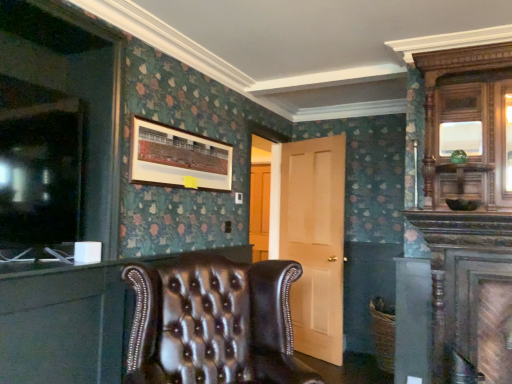
Question: Based on their sizes in the image, would you say matte wooden picture frame at upper center is bigger or smaller than leather tufted chair at lower left?

Choices:
 (A) small
 (B) big

Answer: (A)

Question: From a real-world perspective, is matte wooden picture frame at upper center physically located above or below leather tufted chair at lower left?

Choices:
 (A) below
 (B) above

Answer: (B)

Question: Which object is the farthest from the leather tufted chair at center?

Choices:
 (A) polished wood armoire at upper right
 (B) matte wooden picture frame at upper center
 (C) leather tufted chair at lower left
 (D) light wood door at center

Answer: (D)

Question: Estimate the real-world distances between objects in this image. Which object is farther from the polished wood armoire at upper right?

Choices:
 (A) light wood door at center
 (B) leather tufted chair at center
 (C) matte wooden picture frame at upper center
 (D) leather tufted chair at lower left

Answer: (D)